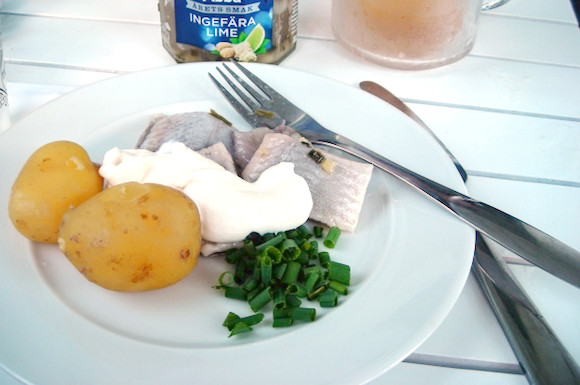
Where is `knife handle`? knife handle is located at coordinates (522, 325).